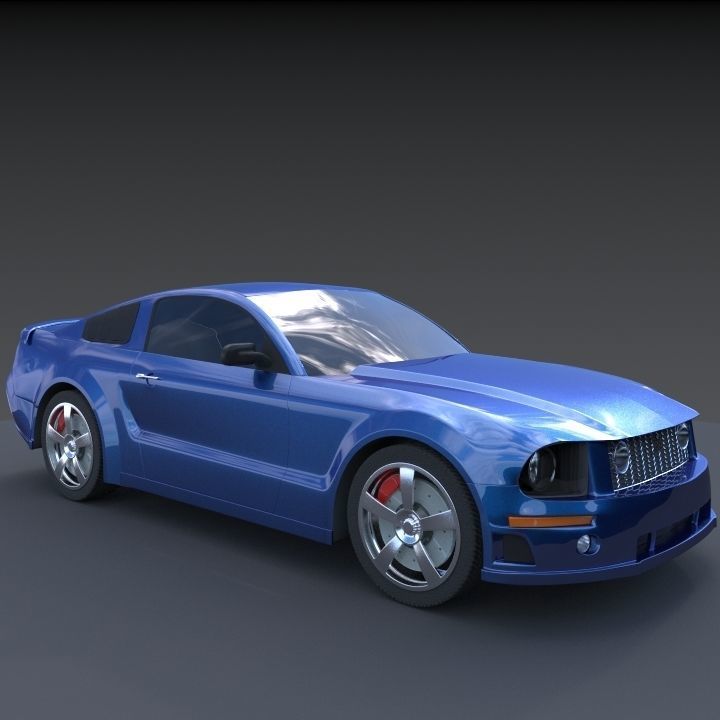
I want to click on window, so click(189, 343).